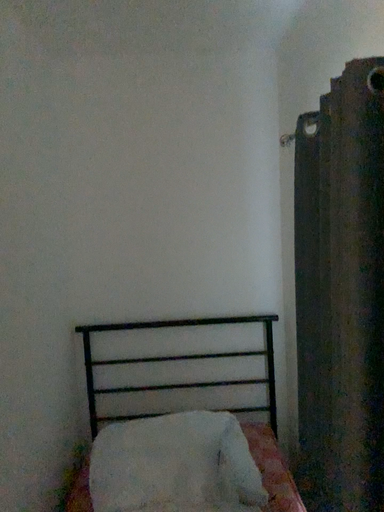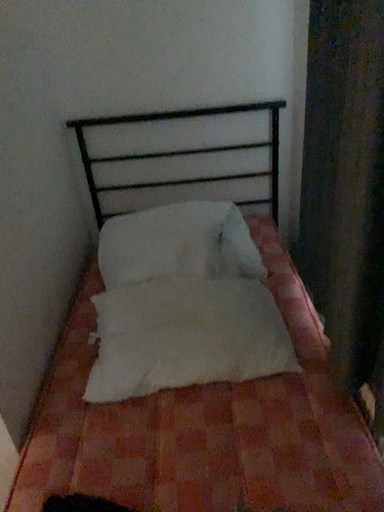
Question: Which way did the camera rotate in the video?

Choices:
 (A) rotated upward
 (B) rotated downward

Answer: (B)